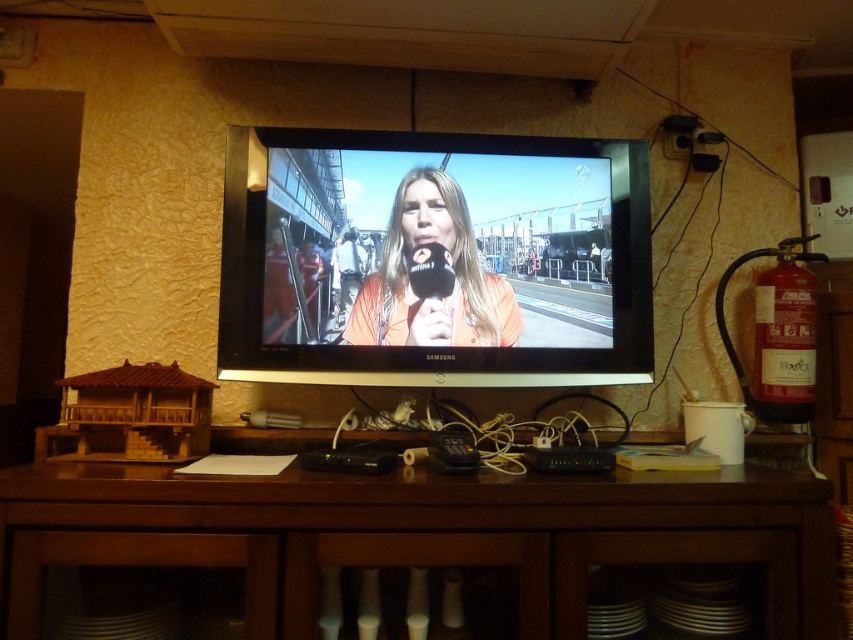
Question: Which point is closer to the camera?

Choices:
 (A) click(x=526, y=529)
 (B) click(x=310, y=252)
 (C) click(x=378, y=305)

Answer: (A)

Question: Which of the following is the farthest from the observer?

Choices:
 (A) orange matte/matteobject at center
 (B) brown wood entertainment center at lower center
 (C) orange fabric microphone at center

Answer: (C)

Question: Does orange matte/matteobject at center appear on the left side of orange fabric microphone at center?

Choices:
 (A) no
 (B) yes

Answer: (A)

Question: Does brown wood entertainment center at lower center appear on the left side of orange fabric microphone at center?

Choices:
 (A) no
 (B) yes

Answer: (A)

Question: Is brown wood entertainment center at lower center behind orange fabric microphone at center?

Choices:
 (A) yes
 (B) no

Answer: (B)

Question: Which of the following is the farthest from the observer?

Choices:
 (A) (463, 202)
 (B) (183, 534)

Answer: (A)